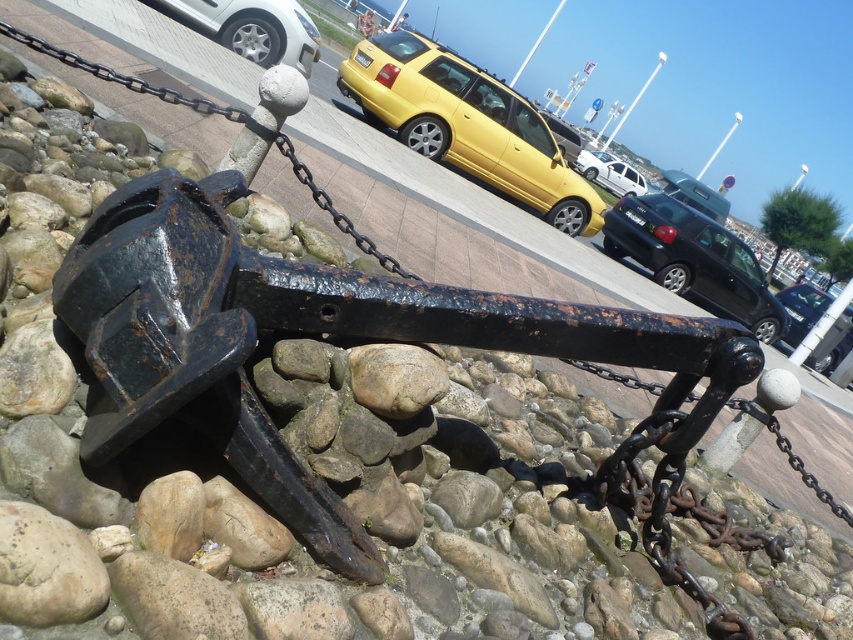
Measure the distance from shiny black sedan at center to metallic silver car at center.

shiny black sedan at center is 38.22 feet from metallic silver car at center.

Who is taller, shiny black sedan at center or metallic silver car at center?

shiny black sedan at center is taller.

This screenshot has width=853, height=640. Describe the element at coordinates (694, 259) in the screenshot. I see `shiny black sedan at center` at that location.

Identify the location of shiny black sedan at center. Image resolution: width=853 pixels, height=640 pixels. (694, 259).

Which is in front, point (630, 177) or point (685, 200)?

Positioned in front is point (630, 177).

Measure the distance between white matte van at center and metallic silver car at center.

They are 7.34 feet apart.

The height and width of the screenshot is (640, 853). Describe the element at coordinates (610, 172) in the screenshot. I see `white matte van at center` at that location.

In order to click on white matte van at center in this screenshot , I will do `click(610, 172)`.

Between shiny black sedan at center and silver metallic car at upper left, which one is positioned lower?

Positioned lower is shiny black sedan at center.

Can you confirm if shiny black sedan at center is shorter than silver metallic car at upper left?

Incorrect, shiny black sedan at center's height does not fall short of silver metallic car at upper left's.

Who is more forward, (753, 273) or (215, 17)?

Positioned in front is point (215, 17).

What are the coordinates of `shiny black sedan at center` in the screenshot? It's located at (694, 259).